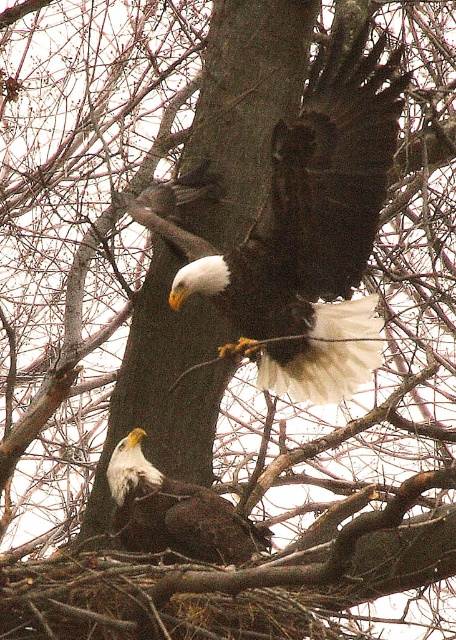
Based on the photo, you are a photographer trying to capture the bald eagle closest to the camera. You notice two points in the image labeled as point (311,225) and point (193,538). Which point should you focus on to ensure the eagle closer to the camera is in sharp focus?

Point (311,225) is further to the camera than point (193,538), so focusing on point (311,225) will ensure the eagle closer to the camera is in sharp focus.

You are standing in a forest and want to take a photo of the brown rough tree trunk at center. If your camera has a maximum zoom range of 15 meters, will you be able to capture the tree trunk clearly without moving closer?

The brown rough tree trunk at center is 16.85 meters away from the camera. Since the camera can only zoom up to 15 meters, you won not be able to capture the tree trunk clearly without moving closer.

You are a birdwatcher observing two features in the center of the image. One is the dark brown feathers at center and the other is the brown rough tree trunk at center. Which one is located to the right?

The dark brown feathers at center is positioned on the right side of brown rough tree trunk at center.